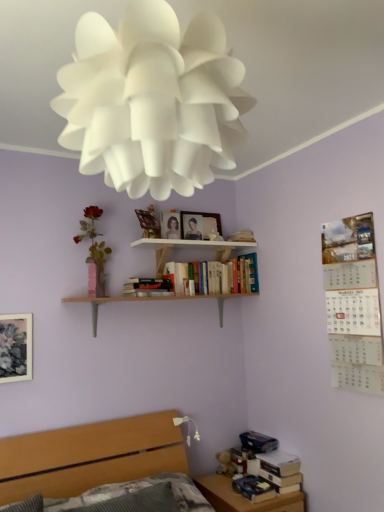
I want to click on vacant space underneath matte black tool at center, the 3th book in the bottom-to-top sequence (from a real-world perspective), so click(x=145, y=298).